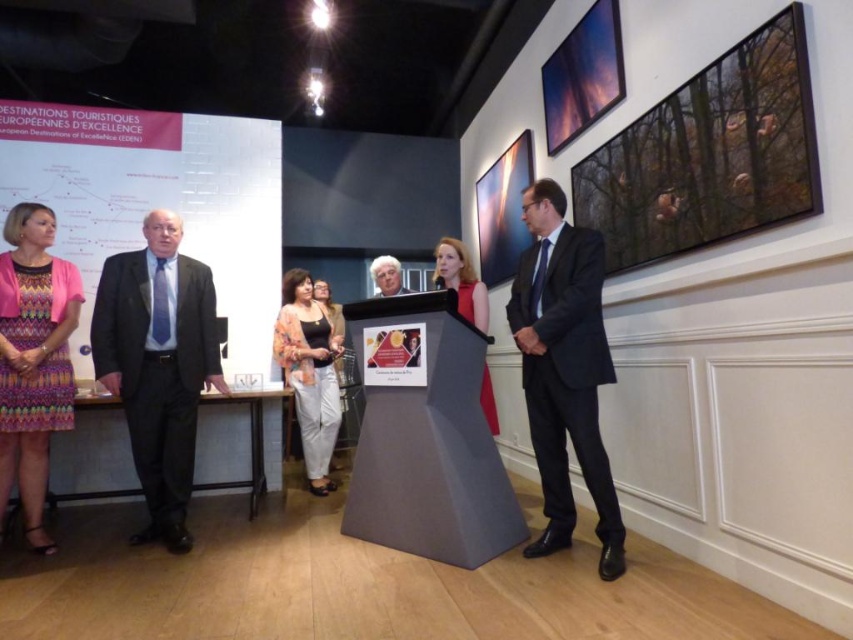
From the picture: Is matte gray podium at center bigger than black suit at left?

Correct, matte gray podium at center is larger in size than black suit at left.

Looking at this image, how much distance is there between matte gray podium at center and black suit at left?

The distance of matte gray podium at center from black suit at left is 3.40 feet.

Does point (428, 408) come farther from viewer compared to point (120, 376)?

No.

You are a GUI agent. You are given a task and a screenshot of the screen. Output one action in this format:
    pyautogui.click(x=<x>, y=<y>)
    Task: Click on the matte gray podium at center
    The width and height of the screenshot is (853, 640).
    Given the screenshot: What is the action you would take?
    [x=426, y=435]

Who is taller, dark blue suit at center or white matte hair at center?

dark blue suit at center is taller.

This screenshot has height=640, width=853. Find the location of `dark blue suit at center`. dark blue suit at center is located at coordinates [564, 369].

Can you confirm if metallic glass picture frame at upper center is positioned below matte black top at center?

No.

Can you confirm if metallic glass picture frame at upper center is smaller than matte black top at center?

Correct, metallic glass picture frame at upper center occupies less space than matte black top at center.

The height and width of the screenshot is (640, 853). I want to click on metallic glass picture frame at upper center, so click(582, 76).